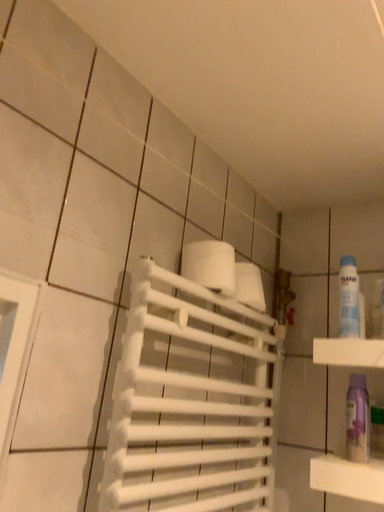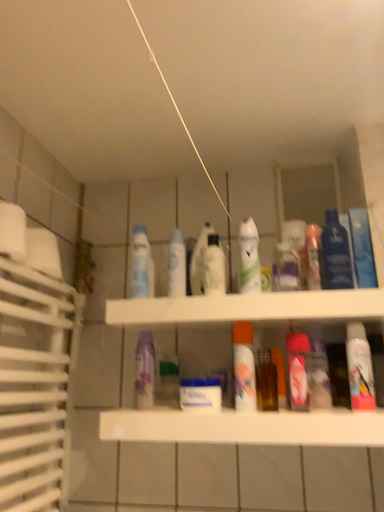
Question: Which way did the camera rotate in the video?

Choices:
 (A) rotated left
 (B) rotated right

Answer: (B)